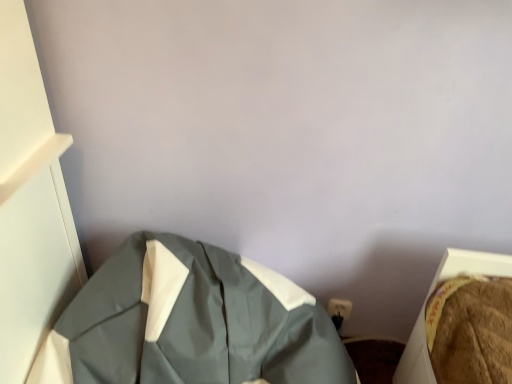
Identify the location of matte gray jacket at center. The height and width of the screenshot is (384, 512). (190, 322).

This screenshot has width=512, height=384. What do you see at coordinates (190, 322) in the screenshot?
I see `matte gray jacket at center` at bounding box center [190, 322].

In order to click on matte gray jacket at center in this screenshot , I will do `click(190, 322)`.